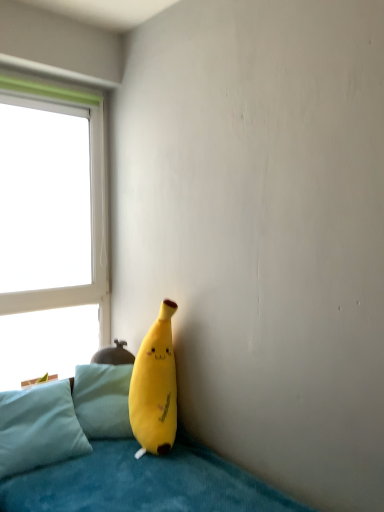
Question: Is light blue plush pillow at lower left wider or thinner than soft blue fabric couch at lower left?

Choices:
 (A) thin
 (B) wide

Answer: (A)

Question: Is light blue plush pillow at lower left in front of or behind soft blue fabric couch at lower left in the image?

Choices:
 (A) front
 (B) behind

Answer: (B)

Question: Estimate the real-world distances between objects in this image. Which object is farther from the soft blue fabric couch at lower left?

Choices:
 (A) yellow plush toy at lower center
 (B) light blue plush pillow at lower left
 (C) white plastic window at upper left

Answer: (C)

Question: Estimate the real-world distances between objects in this image. Which object is farther from the yellow plush toy at lower center?

Choices:
 (A) white plastic window at upper left
 (B) soft blue fabric couch at lower left
 (C) light blue plush pillow at lower left

Answer: (A)